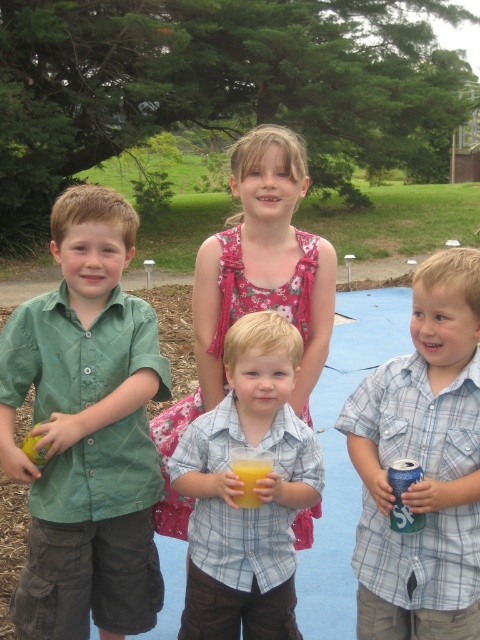
Question: Does blue plaid shirt at center appear on the left side of blue metallic can at lower right?

Choices:
 (A) yes
 (B) no

Answer: (B)

Question: Does blue plaid shirt at center lie in front of translucent yellow liquid at center?

Choices:
 (A) yes
 (B) no

Answer: (A)

Question: Which object is closer to the camera taking this photo?

Choices:
 (A) yellow matte apple at left
 (B) translucent yellow liquid at center

Answer: (B)

Question: Based on their relative distances, which object is farther from the green cotton shirt at left?

Choices:
 (A) blue plaid shirt at center
 (B) yellow matte apple at left
 (C) translucent yellow liquid at center
 (D) blue metallic can at lower right

Answer: (D)

Question: In this image, where is blue plaid shirt at center located relative to blue metallic can at lower right?

Choices:
 (A) right
 (B) left

Answer: (A)

Question: Which point appears closest to the camera in this image?

Choices:
 (A) (107, 248)
 (B) (244, 348)

Answer: (B)